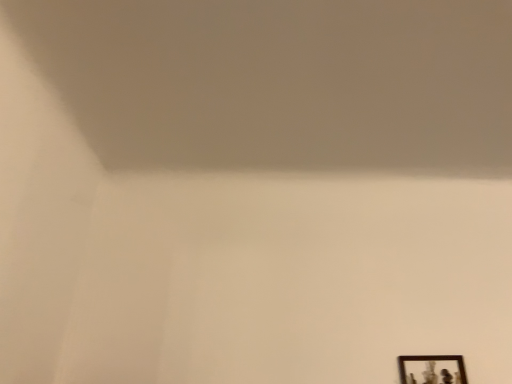
What do you see at coordinates (432, 369) in the screenshot? I see `wooden framed picture at lower right` at bounding box center [432, 369].

In order to face wooden framed picture at lower right, should I rotate leftwards or rightwards?

Rotate your view right by about 22.920°.

Identify the location of wooden framed picture at lower right. This screenshot has height=384, width=512. (432, 369).

The width and height of the screenshot is (512, 384). What do you see at coordinates (282, 81) in the screenshot? I see `white matte wall at upper center` at bounding box center [282, 81].

This screenshot has width=512, height=384. In order to click on white matte wall at upper center in this screenshot , I will do coord(282,81).

This screenshot has width=512, height=384. I want to click on wooden framed picture at lower right, so click(432, 369).

Considering the positions of objects white matte wall at upper center and wooden framed picture at lower right in the image provided, who is more to the right, white matte wall at upper center or wooden framed picture at lower right?

wooden framed picture at lower right.

In the image, is white matte wall at upper center positioned in front of or behind wooden framed picture at lower right?

Clearly, white matte wall at upper center is in front of wooden framed picture at lower right.

Which is behind, point (360, 165) or point (401, 376)?

The point (360, 165) is farther.

From the image's perspective, is white matte wall at upper center positioned above or below wooden framed picture at lower right?

From the image's perspective, white matte wall at upper center appears above wooden framed picture at lower right.

From a real-world perspective, which object stands above the other?

From a 3D spatial view, white matte wall at upper center is above.

Consider the image. Which object is thinner, white matte wall at upper center or wooden framed picture at lower right?

wooden framed picture at lower right.

Is white matte wall at upper center shorter than wooden framed picture at lower right?

Yes, white matte wall at upper center is shorter than wooden framed picture at lower right.

Who is smaller, white matte wall at upper center or wooden framed picture at lower right?

wooden framed picture at lower right.

Would you say white matte wall at upper center is inside or outside wooden framed picture at lower right?

white matte wall at upper center lies outside wooden framed picture at lower right.

Based on the photo, are white matte wall at upper center and wooden framed picture at lower right beside each other?

A: No, white matte wall at upper center is not with wooden framed picture at lower right.

Could you tell me if white matte wall at upper center is turned towards wooden framed picture at lower right?

No, white matte wall at upper center does not turn towards wooden framed picture at lower right.

How different are the orientations of white matte wall at upper center and wooden framed picture at lower right in degrees?

There is a 88.9-degree angle between the facing directions of white matte wall at upper center and wooden framed picture at lower right.

Where is `picture frame that is behind the white matte wall at upper center`? This screenshot has width=512, height=384. picture frame that is behind the white matte wall at upper center is located at coordinates (432, 369).

From the picture: Which is more to the right, wooden framed picture at lower right or white matte wall at upper center?

Positioned to the right is wooden framed picture at lower right.

Is wooden framed picture at lower right positioned before white matte wall at upper center?

No, it is behind white matte wall at upper center.

Considering the positions of points (434, 358) and (140, 87), is point (434, 358) farther from camera compared to point (140, 87)?

Yes.

From the image's perspective, is wooden framed picture at lower right positioned above or below white matte wall at upper center?

Based on their image positions, wooden framed picture at lower right is located beneath white matte wall at upper center.

From a real-world perspective, is wooden framed picture at lower right positioned above or below white matte wall at upper center?

In terms of real-world spatial position, wooden framed picture at lower right is below white matte wall at upper center.

Based on the photo, between wooden framed picture at lower right and white matte wall at upper center, which one has smaller width?

Thinner between the two is wooden framed picture at lower right.

Is wooden framed picture at lower right shorter than white matte wall at upper center?

No.

Does wooden framed picture at lower right have a smaller size compared to white matte wall at upper center?

Correct, wooden framed picture at lower right occupies less space than white matte wall at upper center.

In the scene shown: Do you think wooden framed picture at lower right is within white matte wall at upper center, or outside of it?

wooden framed picture at lower right is located beyond the bounds of white matte wall at upper center.

Is wooden framed picture at lower right not close to white matte wall at upper center?

No, wooden framed picture at lower right is in close proximity to white matte wall at upper center.

In the scene shown: Is wooden framed picture at lower right oriented towards white matte wall at upper center?

No.

Image resolution: width=512 pixels, height=384 pixels. I want to click on wide above the wooden framed picture at lower right (from a real-world perspective), so click(282, 81).

The width and height of the screenshot is (512, 384). There is a wooden framed picture at lower right. Find the location of `wide above it (from a real-world perspective)`. wide above it (from a real-world perspective) is located at coordinates (282, 81).

What are the coordinates of `picture frame that is behind the white matte wall at upper center` in the screenshot? It's located at (432, 369).